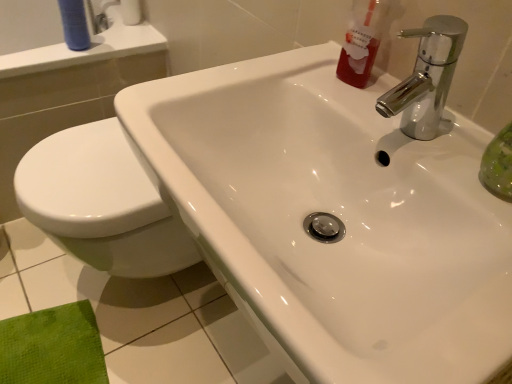
The width and height of the screenshot is (512, 384). Find the location of `translucent red liquid at upper right`. translucent red liquid at upper right is located at coordinates (361, 41).

Find the location of a particular element. white paper towel at upper left is located at coordinates (130, 12).

From a real-world perspective, is blue matte tube at upper left over translucent red liquid at upper right?

No, from a real-world perspective, blue matte tube at upper left is not above translucent red liquid at upper right.

Choose the correct answer: Is blue matte tube at upper left inside translucent red liquid at upper right or outside it?

blue matte tube at upper left lies outside translucent red liquid at upper right.

Considering the relative sizes of blue matte tube at upper left and translucent red liquid at upper right in the image provided, is blue matte tube at upper left thinner than translucent red liquid at upper right?

Correct, the width of blue matte tube at upper left is less than that of translucent red liquid at upper right.

Is blue matte tube at upper left to the right of translucent red liquid at upper right from the viewer's perspective?

Incorrect, blue matte tube at upper left is not on the right side of translucent red liquid at upper right.

Is chrome metallic faucet at upper right oriented away from translucent red liquid at upper right?

chrome metallic faucet at upper right does not have its back to translucent red liquid at upper right.

Do you think chrome metallic faucet at upper right is within translucent red liquid at upper right, or outside of it?

The correct answer is: outside.

Looking at this image, is chrome metallic faucet at upper right wider or thinner than translucent red liquid at upper right?

Clearly, chrome metallic faucet at upper right has more width compared to translucent red liquid at upper right.

From the image's perspective, does chrome metallic faucet at upper right appear higher than translucent red liquid at upper right?

No, from the image's perspective, chrome metallic faucet at upper right is not on top of translucent red liquid at upper right.

From the image's perspective, which is below, translucent red liquid at upper right or chrome metallic faucet at upper right?

chrome metallic faucet at upper right, from the image's perspective.

Which of these two, translucent red liquid at upper right or chrome metallic faucet at upper right, is thinner?

Thinner between the two is translucent red liquid at upper right.

Are translucent red liquid at upper right and chrome metallic faucet at upper right located far from each other?

No, translucent red liquid at upper right is in close proximity to chrome metallic faucet at upper right.

Looking at this image, from a real-world perspective, which is physically above, translucent red liquid at upper right or chrome metallic faucet at upper right?

translucent red liquid at upper right is physically above.

Considering the points (424, 95) and (139, 14), which point is behind, point (424, 95) or point (139, 14)?

The point (139, 14) is behind.

From a real-world perspective, is chrome metallic faucet at upper right above or below white paper towel at upper left?

Clearly, from a real-world perspective, chrome metallic faucet at upper right is above white paper towel at upper left.

Looking at this image, considering the relative sizes of chrome metallic faucet at upper right and white paper towel at upper left in the image provided, is chrome metallic faucet at upper right bigger than white paper towel at upper left?

Indeed, chrome metallic faucet at upper right has a larger size compared to white paper towel at upper left.

Is blue matte tube at upper left taller than white paper towel at upper left?

Yes.

Between blue matte tube at upper left and white paper towel at upper left, which one is positioned in front?

Positioned in front is blue matte tube at upper left.

Which of these two, blue matte tube at upper left or white paper towel at upper left, is bigger?

white paper towel at upper left.

Is blue matte tube at upper left spatially inside white paper towel at upper left, or outside of it?

blue matte tube at upper left lies outside white paper towel at upper left.

Considering the relative sizes of translucent red liquid at upper right and white paper towel at upper left in the image provided, is translucent red liquid at upper right taller than white paper towel at upper left?

Yes, translucent red liquid at upper right is taller than white paper towel at upper left.

Is translucent red liquid at upper right turned away from white paper towel at upper left?

No, translucent red liquid at upper right is not facing the opposite direction of white paper towel at upper left.

From the image's perspective, which is below, translucent red liquid at upper right or white paper towel at upper left?

translucent red liquid at upper right.

Between translucent red liquid at upper right and white paper towel at upper left, which one is positioned behind?

white paper towel at upper left is more distant.

Which of these two, white paper towel at upper left or translucent red liquid at upper right, stands taller?

translucent red liquid at upper right is taller.

From the image's perspective, would you say white paper towel at upper left is shown under translucent red liquid at upper right?

No.

Which object is thinner, white paper towel at upper left or translucent red liquid at upper right?

With smaller width is translucent red liquid at upper right.

Identify the location of toiletry above the translucent red liquid at upper right (from the image's perspective). (74, 24).

Identify the location of tap below the translucent red liquid at upper right (from a real-world perspective). The image size is (512, 384). (426, 77).

Estimate the real-world distances between objects in this image. Which object is closer to translucent red liquid at upper right, white paper towel at upper left or chrome metallic faucet at upper right?

The object closer to translucent red liquid at upper right is chrome metallic faucet at upper right.

Which object lies nearer to the anchor point chrome metallic faucet at upper right, translucent red liquid at upper right or blue matte tube at upper left?

translucent red liquid at upper right is closer to chrome metallic faucet at upper right.

Looking at the image, which one is located closer to chrome metallic faucet at upper right, blue matte tube at upper left or white paper towel at upper left?

blue matte tube at upper left is positioned closer to the anchor chrome metallic faucet at upper right.

From the image, which object appears to be nearer to translucent red liquid at upper right, chrome metallic faucet at upper right or white paper towel at upper left?

chrome metallic faucet at upper right is positioned closer to the anchor translucent red liquid at upper right.

When comparing their distances from chrome metallic faucet at upper right, does translucent red liquid at upper right or white paper towel at upper left seem further?

white paper towel at upper left lies further to chrome metallic faucet at upper right than the other object.

Considering their positions, is translucent red liquid at upper right positioned closer to blue matte tube at upper left than chrome metallic faucet at upper right?

translucent red liquid at upper right.

Based on their spatial positions, is blue matte tube at upper left or chrome metallic faucet at upper right further from white paper towel at upper left?

Based on the image, chrome metallic faucet at upper right appears to be further to white paper towel at upper left.

Based on their spatial positions, is translucent red liquid at upper right or white paper towel at upper left further from blue matte tube at upper left?

The object further to blue matte tube at upper left is translucent red liquid at upper right.

Find the location of a particular element. toiletry between chrome metallic faucet at upper right and white paper towel at upper left along the z-axis is located at coordinates (74, 24).

Image resolution: width=512 pixels, height=384 pixels. I want to click on cleaning product between chrome metallic faucet at upper right and white paper towel at upper left along the z-axis, so click(x=361, y=41).

Image resolution: width=512 pixels, height=384 pixels. I want to click on toiletry between translucent red liquid at upper right and white paper towel at upper left in the front-back direction, so click(74, 24).

The width and height of the screenshot is (512, 384). What are the coordinates of `cleaning product between blue matte tube at upper left and chrome metallic faucet at upper right in the horizontal direction` in the screenshot? It's located at (361, 41).